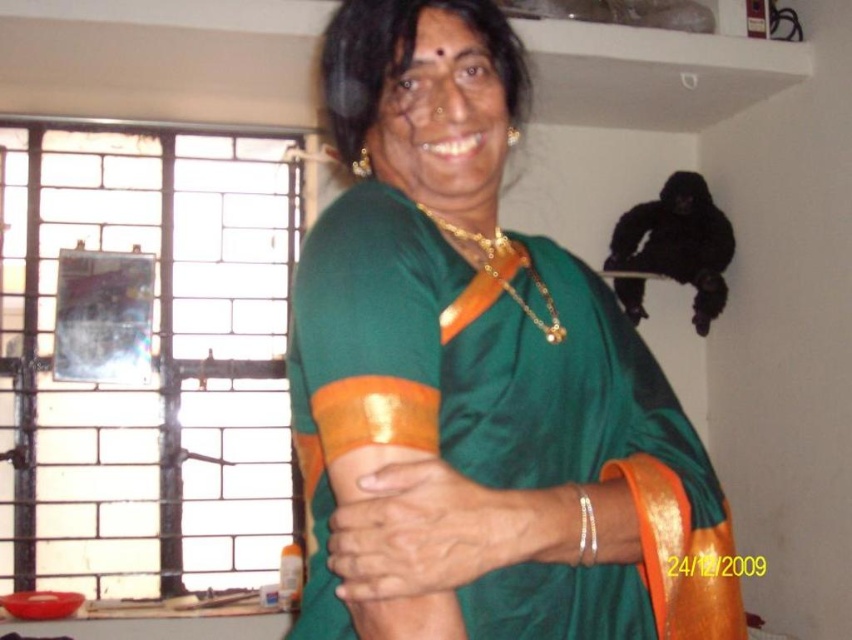
The person is wearing a green silk saree at center and a gold chain at upper center. Which of these two items has a greater width?

The green silk saree at center has a greater width than the gold chain at upper center according to the description provided.

Looking at this image, you are taking a photo of the person in the scene. You want to focus your camera on the point that is closer to the camera. Which point should you choose between point (419,488) and point (486,250)?

You should focus on point (419,488) because it is closer to the camera than point (486,250).